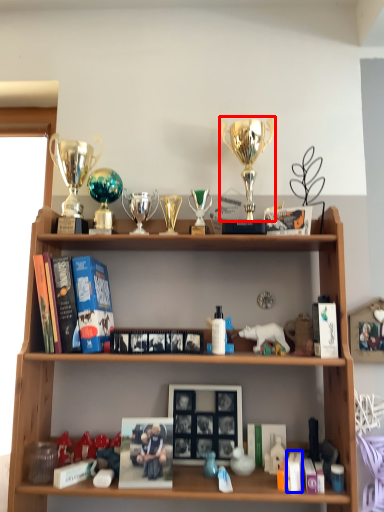
Question: Which object is closer to the camera taking this photo, trophy (highlighted by a red box) or book (highlighted by a blue box)?

Choices:
 (A) trophy
 (B) book

Answer: (B)